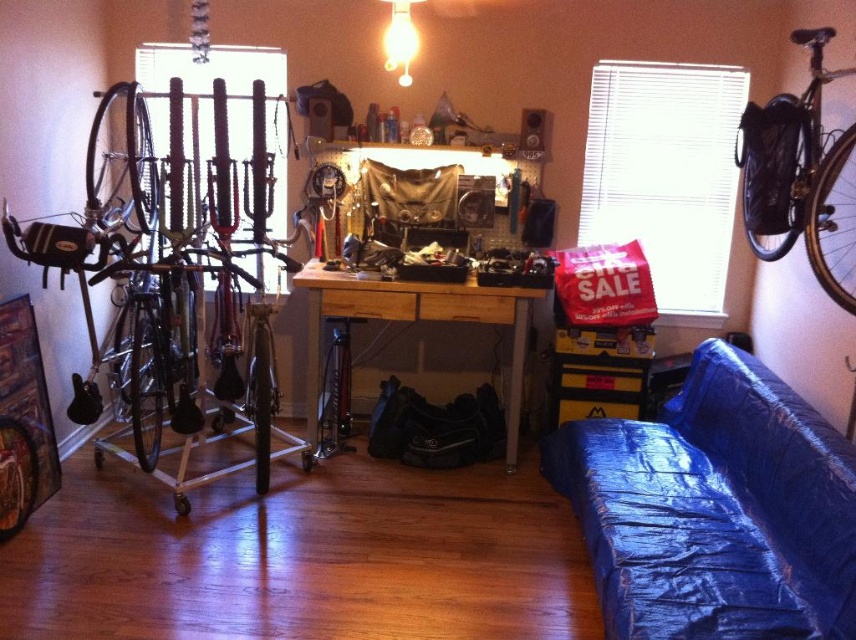
Question: Does blue tarp-covered couch at lower right appear under shiny black bike at left?

Choices:
 (A) yes
 (B) no

Answer: (A)

Question: Which point is closer to the camera taking this photo?

Choices:
 (A) (815, 90)
 (B) (214, 84)
 (C) (675, 502)

Answer: (C)

Question: Among these points, which one is farthest from the camera?

Choices:
 (A) (837, 154)
 (B) (519, 376)
 (C) (189, 326)

Answer: (B)

Question: Among these points, which one is nearest to the camera?

Choices:
 (A) (786, 225)
 (B) (194, 371)
 (C) (530, 305)
 (D) (640, 576)

Answer: (D)

Question: Is blue tarp-covered couch at lower right closer to camera compared to wooden desk at center?

Choices:
 (A) yes
 (B) no

Answer: (A)

Question: Can you confirm if blue tarp-covered couch at lower right is thinner than shiny black bicycle at upper right?

Choices:
 (A) yes
 (B) no

Answer: (B)